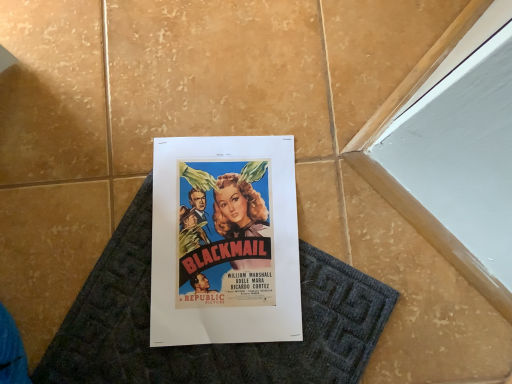
Question: Considering the relative sizes of matte paper poster at center and dark gray textured bath mat at center in the image provided, is matte paper poster at center shorter than dark gray textured bath mat at center?

Choices:
 (A) yes
 (B) no

Answer: (B)

Question: Does matte paper poster at center have a greater width compared to dark gray textured bath mat at center?

Choices:
 (A) no
 (B) yes

Answer: (B)

Question: From the image's perspective, is matte paper poster at center below dark gray textured bath mat at center?

Choices:
 (A) yes
 (B) no

Answer: (B)

Question: Is matte paper poster at center oriented away from dark gray textured bath mat at center?

Choices:
 (A) yes
 (B) no

Answer: (A)

Question: Can you confirm if matte paper poster at center is thinner than dark gray textured bath mat at center?

Choices:
 (A) yes
 (B) no

Answer: (B)

Question: Can you see matte paper poster at center touching dark gray textured bath mat at center?

Choices:
 (A) no
 (B) yes

Answer: (B)

Question: From the image's perspective, is dark gray textured bath mat at center under matte paper poster at center?

Choices:
 (A) yes
 (B) no

Answer: (A)

Question: Is the position of dark gray textured bath mat at center more distant than that of matte paper poster at center?

Choices:
 (A) no
 (B) yes

Answer: (A)

Question: Would you say dark gray textured bath mat at center is outside matte paper poster at center?

Choices:
 (A) no
 (B) yes

Answer: (A)

Question: Could you tell me if dark gray textured bath mat at center is facing matte paper poster at center?

Choices:
 (A) no
 (B) yes

Answer: (B)

Question: Can you confirm if dark gray textured bath mat at center is bigger than matte paper poster at center?

Choices:
 (A) no
 (B) yes

Answer: (B)

Question: Does dark gray textured bath mat at center have a lesser height compared to matte paper poster at center?

Choices:
 (A) no
 (B) yes

Answer: (B)

Question: From a real-world perspective, is matte paper poster at center above or below dark gray textured bath mat at center?

Choices:
 (A) below
 (B) above

Answer: (B)